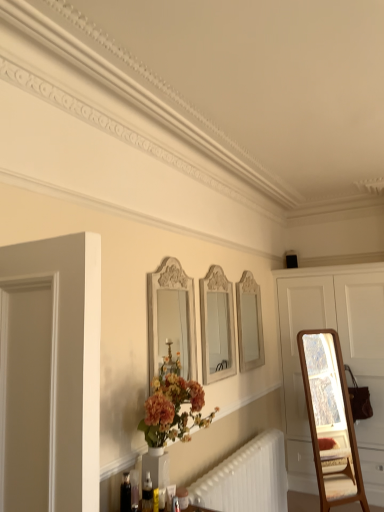
Question: Considering the positions of white wooden dresser at right and white glossy mirror at upper center, marked as the first mirror in a back-to-front arrangement, in the image, is white wooden dresser at right bigger or smaller than white glossy mirror at upper center, marked as the first mirror in a back-to-front arrangement,?

Choices:
 (A) big
 (B) small

Answer: (A)

Question: Based on their positions, is white wooden dresser at right located to the left or right of white glossy mirror at upper center, marked as the first mirror in a back-to-front arrangement?

Choices:
 (A) right
 (B) left

Answer: (A)

Question: Considering the real-world distances, which object is closest to the white carved wood mirror at center, which ranks as the 3th mirror in right-to-left order?

Choices:
 (A) white glossy mirror at upper center, which is counted as the first mirror, starting from the right
 (B) white glossy mirror at center, which is the 2th mirror from back to front
 (C) translucent plastic bottle at lower center
 (D) white wooden dresser at right

Answer: (B)

Question: Based on their relative distances, which object is nearer to the white wooden dresser at right?

Choices:
 (A) white carved wood mirror at center, the first mirror in the front-to-back sequence
 (B) white glossy mirror at center, the second mirror in the left-to-right sequence
 (C) translucent plastic bottle at lower center
 (D) white glossy mirror at upper center, which is the third mirror in front-to-back order

Answer: (D)